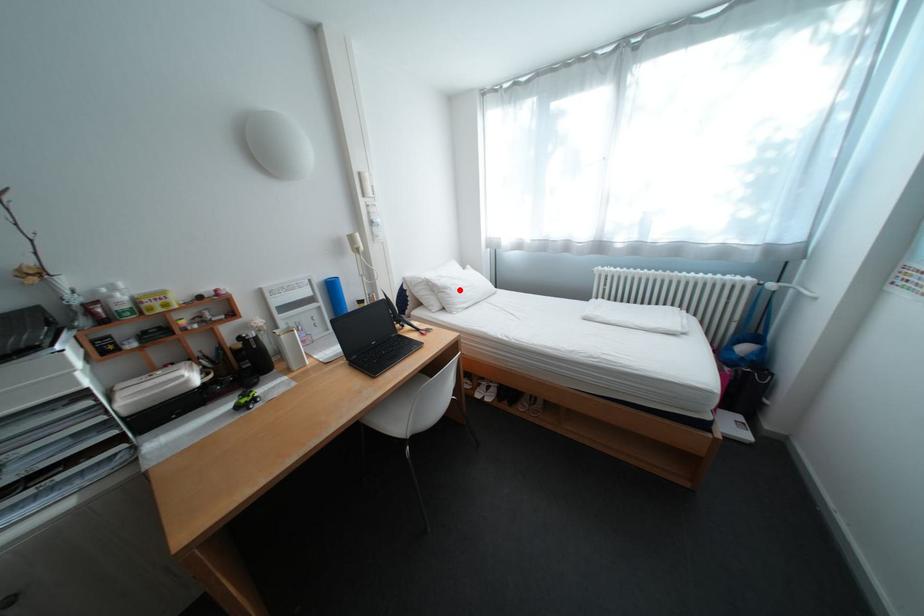
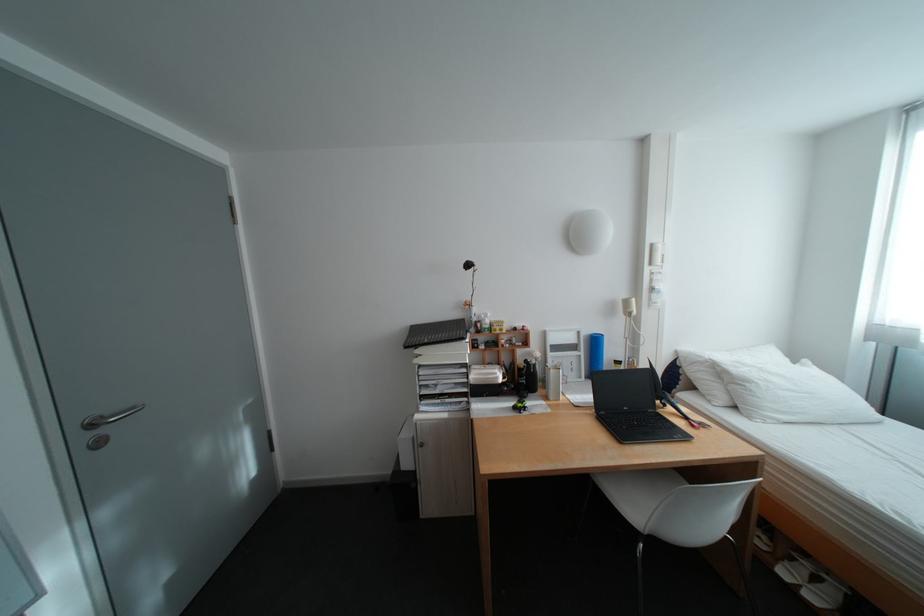
Question: I am providing you with two images of the same scene from different viewpoints. Given a red point in image1, look at the same physical point in image2. Is it:

Choices:
 (A) Closer to the viewpoint
 (B) Farther from the viewpoint

Answer: (B)